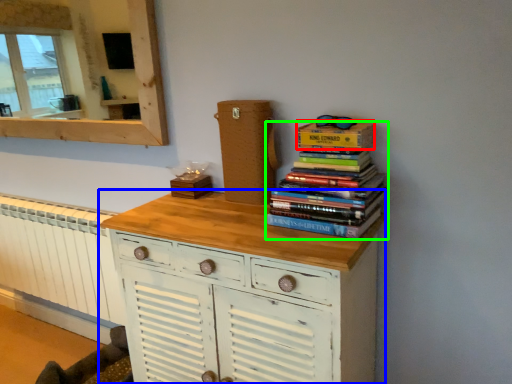
Question: Considering the real-world distances, which object is closest to paperback book (highlighted by a red box)? chest of drawers (highlighted by a blue box) or book (highlighted by a green box).

Choices:
 (A) chest of drawers
 (B) book

Answer: (B)